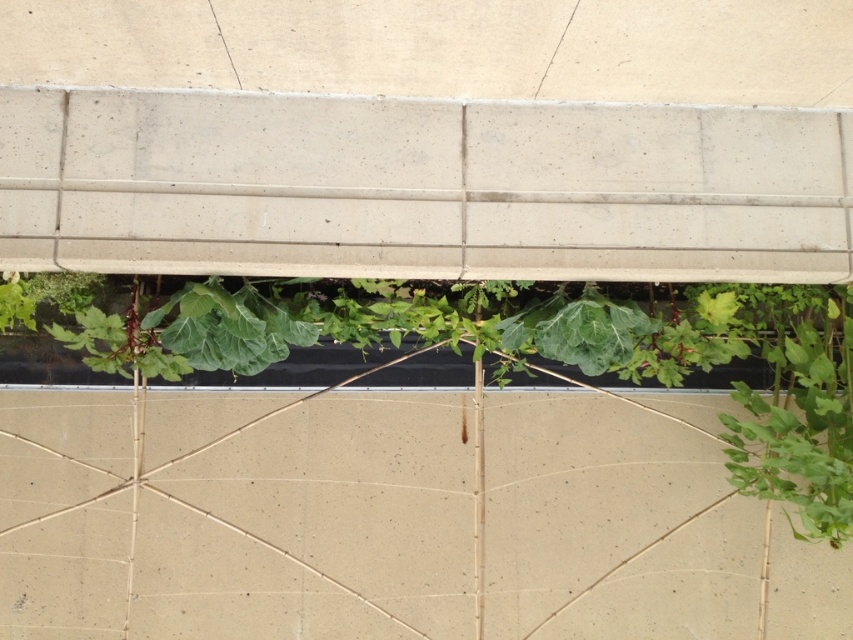
You are standing at the bottom of the concrete structure and want to place a small potted plant exactly at the center of the smooth beige concrete at center. According to the coordinates provided, where should you place the potted plant?

You should place the potted plant at the coordinates point [314,528] on the smooth beige concrete at center.

You are a gardener assessing the space between the smooth beige concrete at center and the green leafy plant at center. Which object takes up more space?

The smooth beige concrete at center is bigger than the green leafy plant at center, so the smooth beige concrete at center occupies more space.

You are a gardener planning to plant a new row of flowers between the smooth beige concrete at center and the green leafy plant at center. Which object should you avoid placing the flowers too close to, based on their sizes?

You should avoid placing the flowers too close to the smooth beige concrete at center because its width is larger than the green leafy plant at center, meaning it occupies more space and may cast more shade or compete for nutrients.